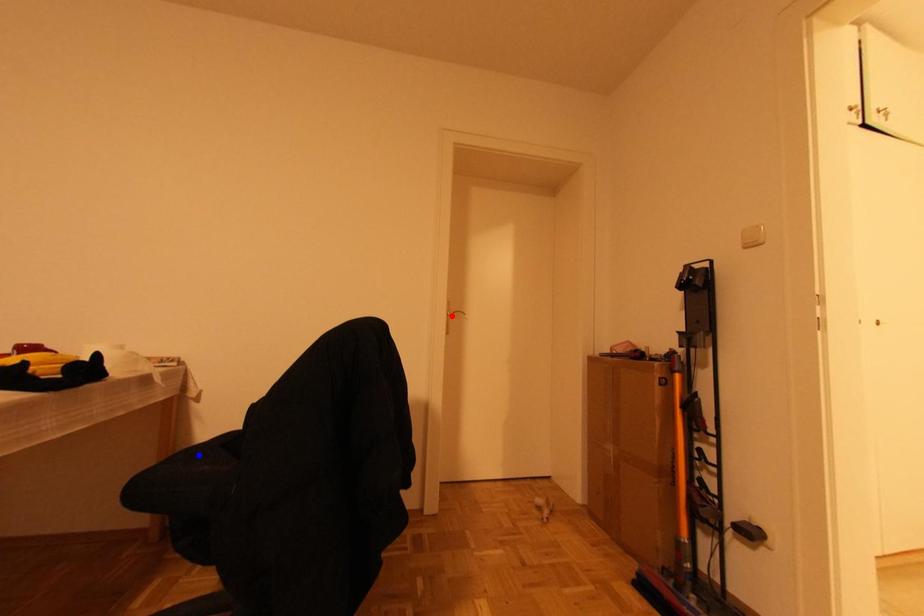
Question: Which of the two points in the image is closer to the camera?

Choices:
 (A) Blue point is closer.
 (B) Red point is closer.

Answer: (A)